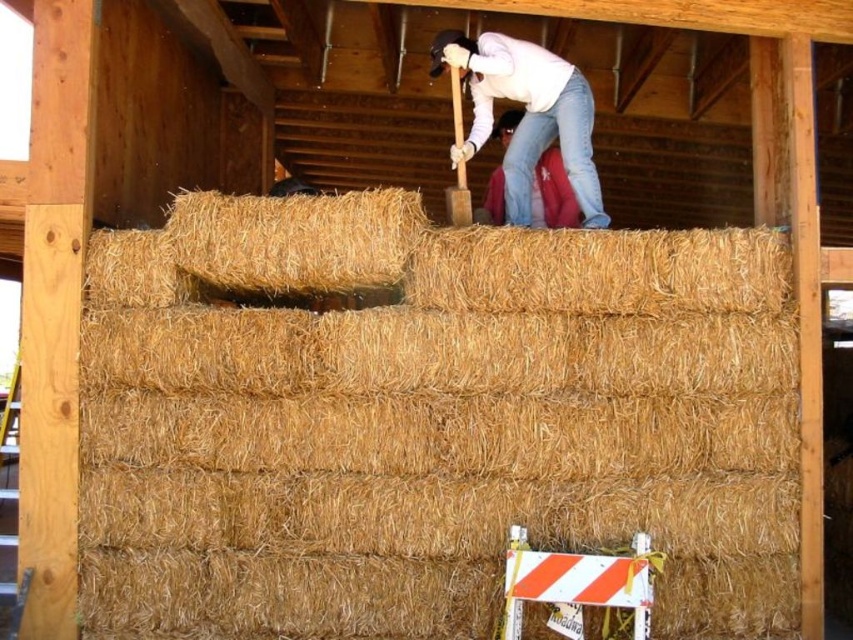
You are standing at the camera position and want to reach the brown straw bale at upper center to inspect it. If your average walking speed is 1.2 meters per second, how many seconds will it take you to reach it?

The distance between the brown straw bale at upper center and the camera is 5.18 meters. At a walking speed of 1.2 meters per second, it would take approximately 4.32 seconds to reach the brown straw bale at upper center.

You are a contractor planning to install a safety barrier between the brown straw bale at upper center and the jeans at upper center. The barrier requires a minimum of 2 meters of space to be installed properly. Based on the scene, can the barrier be installed between these two objects?

The brown straw bale at upper center and jeans at upper center are 1.86 meters apart. Since the required space for the barrier is 2 meters, the distance is insufficient. Therefore, the barrier cannot be installed between them.

You are a contractor assessing the stability of the dry straw bale at upper center in the wooden structure. Given its position at coordinates point 0.375, 0.348, how does this placement affect its structural integrity compared to other potential positions?

The dry straw bale at upper center is located at point [296,240], which is centrally positioned within the wooden framework. This central placement likely provides better load distribution and stability compared to positions closer to the edges, enhancing its structural integrity.